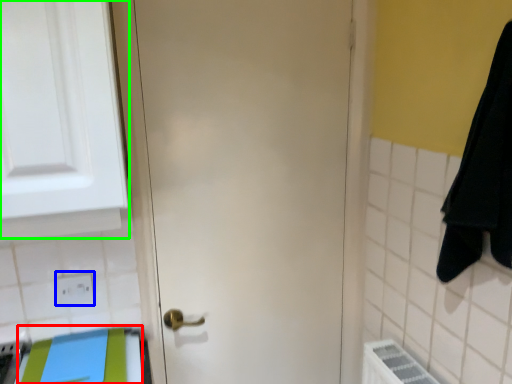
Question: Which object is positioned closest to beach towel (highlighted by a red box)? Select from electric outlet (highlighted by a blue box) and medicine cabinet (highlighted by a green box).

Choices:
 (A) electric outlet
 (B) medicine cabinet

Answer: (A)